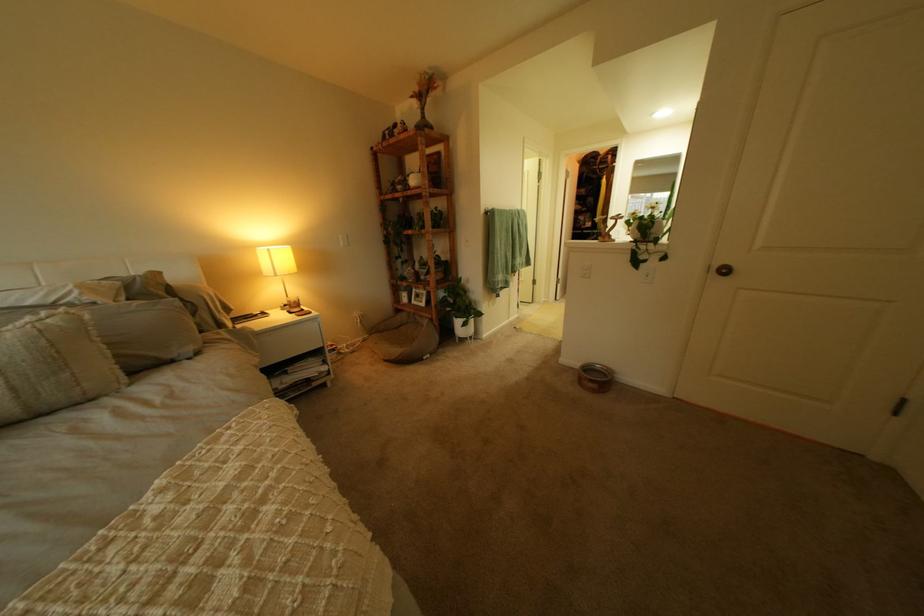
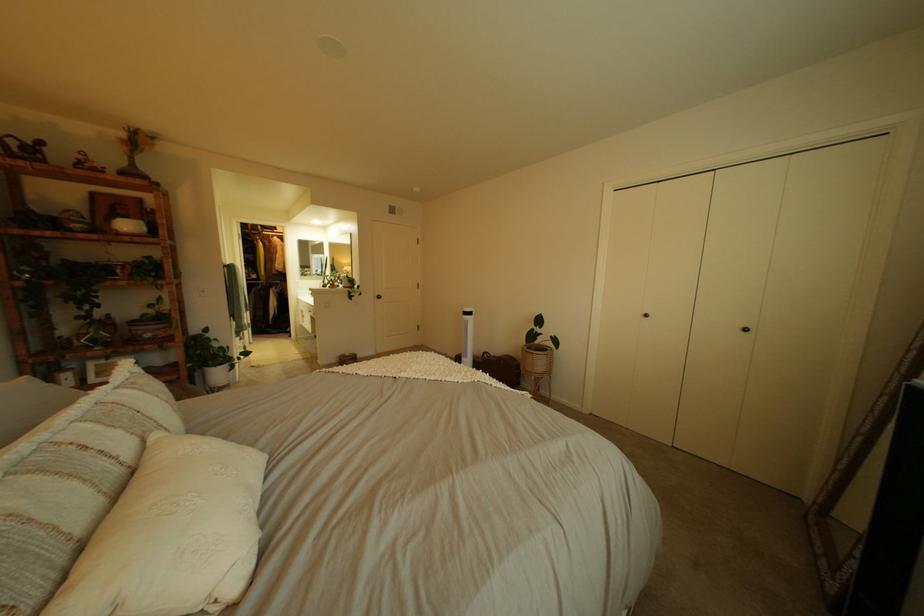
Locate, in the second image, the point that corresponds to (424,188) in the first image.

(132, 232)